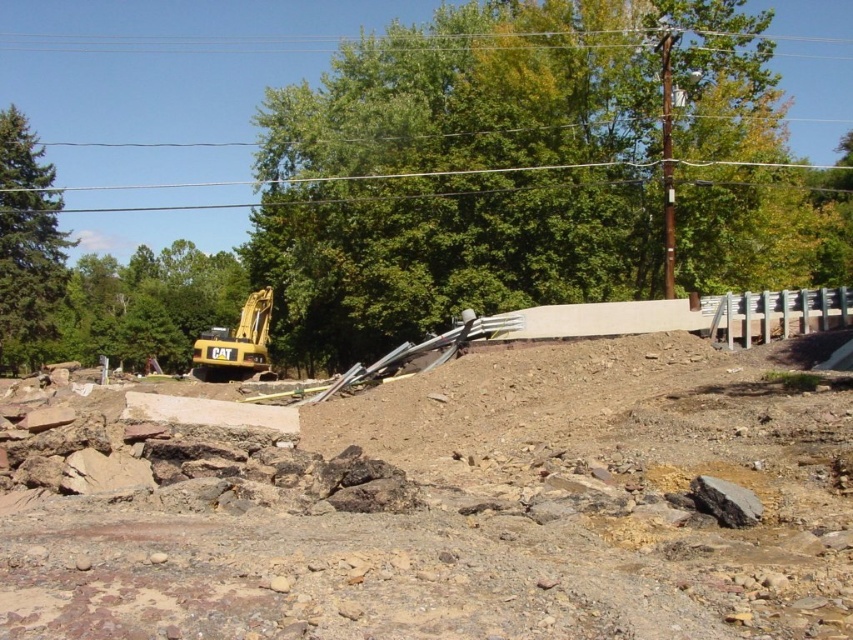
Can you confirm if brown gravel dirt at center is positioned above yellow metallic excavator at left?

Incorrect, brown gravel dirt at center is not positioned above yellow metallic excavator at left.

Does point (105, 435) lie in front of point (228, 328)?

Yes, point (105, 435) is closer to viewer.

Image resolution: width=853 pixels, height=640 pixels. I want to click on brown gravel dirt at center, so click(451, 508).

Does brown gravel dirt at center have a smaller size compared to brushed metal power line at upper center?

Correct, brown gravel dirt at center occupies less space than brushed metal power line at upper center.

Is point (635, 410) closer to viewer compared to point (1, 49)?

That is True.

Who is more distant from viewer, (556, 445) or (152, 52)?

The point (152, 52) is behind.

You are a GUI agent. You are given a task and a screenshot of the screen. Output one action in this format:
    pyautogui.click(x=<x>, y=<y>)
    Task: Click on the brown gravel dirt at center
    
    Given the screenshot: What is the action you would take?
    pyautogui.click(x=451, y=508)

Does brushed metal power line at upper center appear over yellow metallic excavator at left?

Correct, brushed metal power line at upper center is located above yellow metallic excavator at left.

In the scene shown: Is the position of brushed metal power line at upper center less distant than that of yellow metallic excavator at left?

No, brushed metal power line at upper center is further to the viewer.

The height and width of the screenshot is (640, 853). In order to click on brushed metal power line at upper center in this screenshot , I will do `click(165, 44)`.